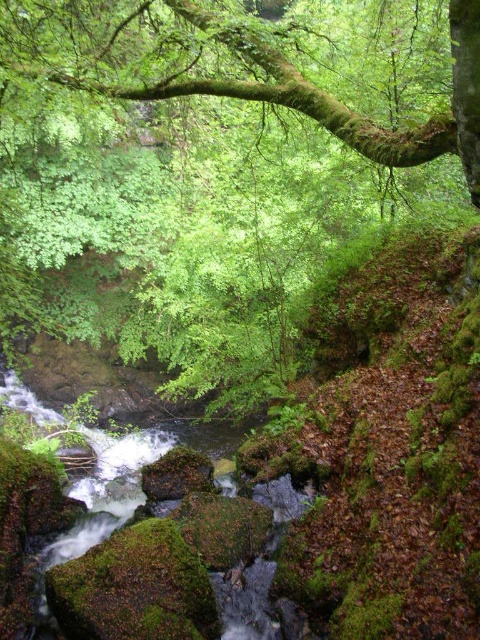
Which of these two, green mossy branch at upper center or green mossy water at center, stands taller?

green mossy water at center is taller.

Find the location of a particular element. green mossy branch at upper center is located at coordinates (344, 104).